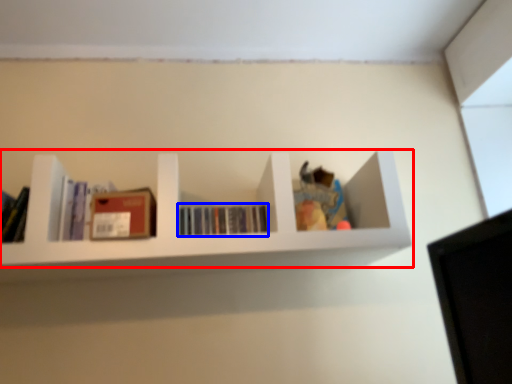
Question: Which object is further to the camera taking this photo, shelf (highlighted by a red box) or book (highlighted by a blue box)?

Choices:
 (A) shelf
 (B) book

Answer: (B)